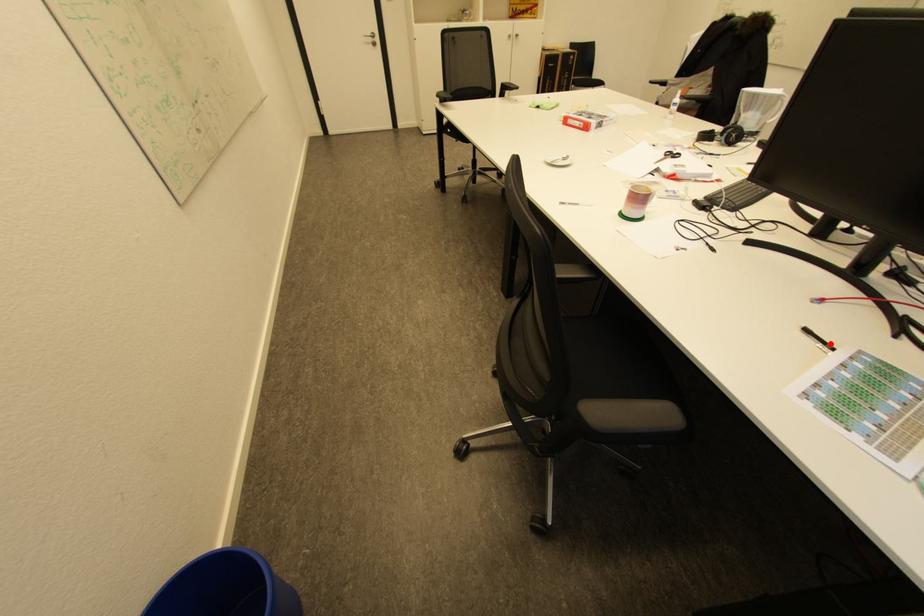
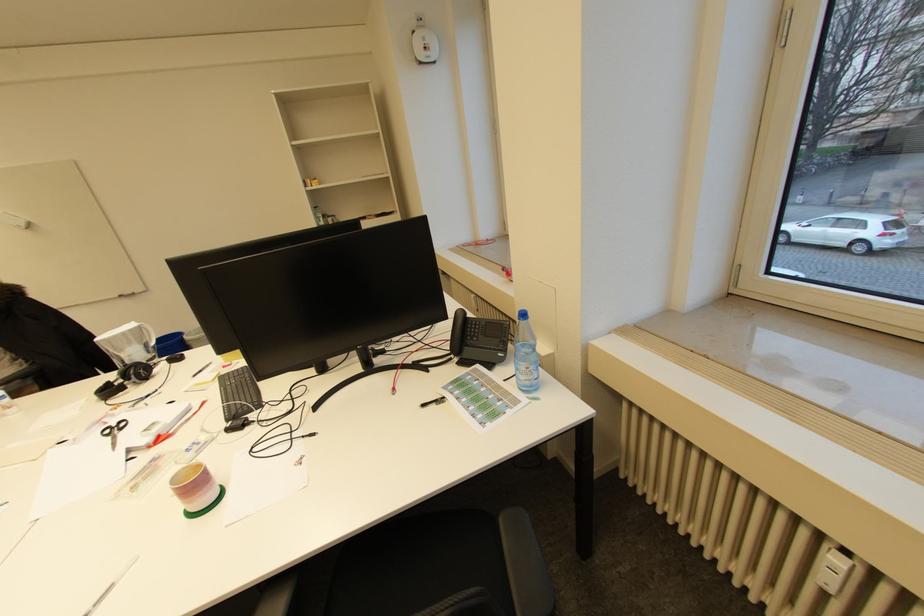
The point at the highlighted location is marked in the first image. Where is the corresponding point in the second image?

(442, 400)